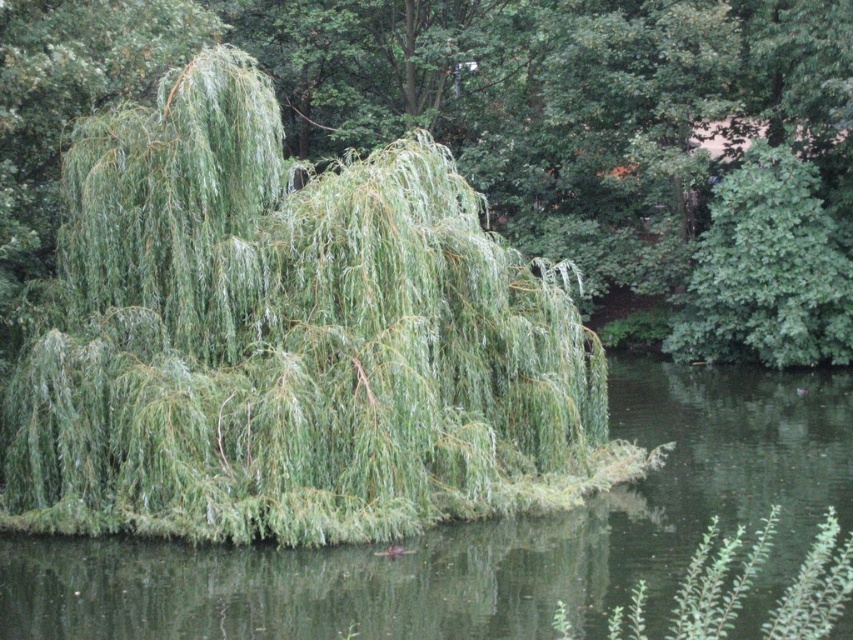
Measure the distance from green leafy willow at center to green leafy lake at center.

green leafy willow at center is 3.73 meters away from green leafy lake at center.

Who is more distant from viewer, (x=517, y=429) or (x=67, y=561)?

Positioned behind is point (x=517, y=429).

You are a GUI agent. You are given a task and a screenshot of the screen. Output one action in this format:
    pyautogui.click(x=<x>, y=<y>)
    Task: Click on the green leafy willow at center
    
    Given the screenshot: What is the action you would take?
    pyautogui.click(x=289, y=340)

Is green leafy tree at center above green leafy lake at center?

Indeed, green leafy tree at center is positioned over green leafy lake at center.

Is green leafy tree at center shorter than green leafy lake at center?

No.

This screenshot has height=640, width=853. Describe the element at coordinates (517, 132) in the screenshot. I see `green leafy tree at center` at that location.

What are the coordinates of `green leafy tree at center` in the screenshot? It's located at (517, 132).

Between green leafy willow at center and green leafy tree at center, which one is positioned higher?

Positioned higher is green leafy tree at center.

Which is below, green leafy willow at center or green leafy tree at center?

green leafy willow at center

I want to click on green leafy willow at center, so click(289, 340).

Locate an element on the screen. green leafy willow at center is located at coordinates (x=289, y=340).